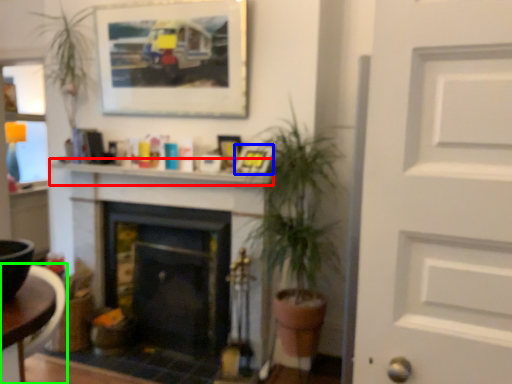
Question: Which object is positioned closest to mantle (highlighted by a red box)? Select from picture frame (highlighted by a blue box) and table (highlighted by a green box).

Choices:
 (A) picture frame
 (B) table

Answer: (A)